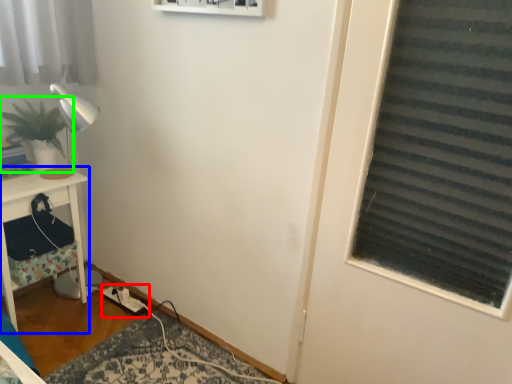
Question: Which object is positioned farthest from extension cord (highlighted by a red box)? Select from furniture (highlighted by a blue box) and houseplant (highlighted by a green box).

Choices:
 (A) furniture
 (B) houseplant

Answer: (B)